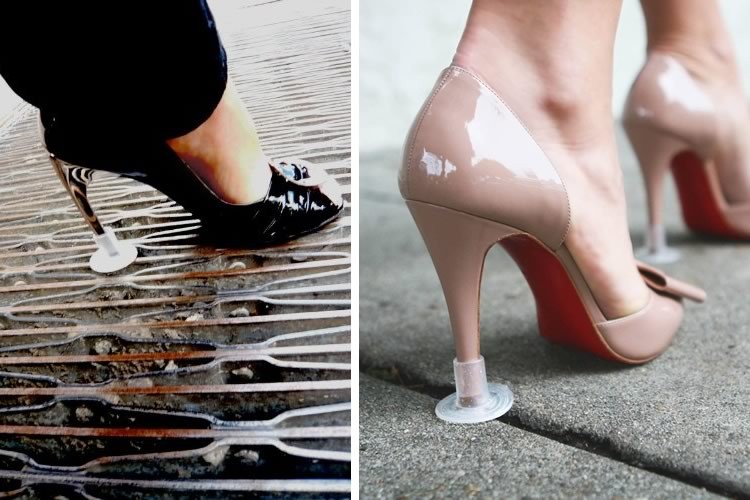
This screenshot has width=750, height=500. I want to click on grate, so click(x=328, y=320).